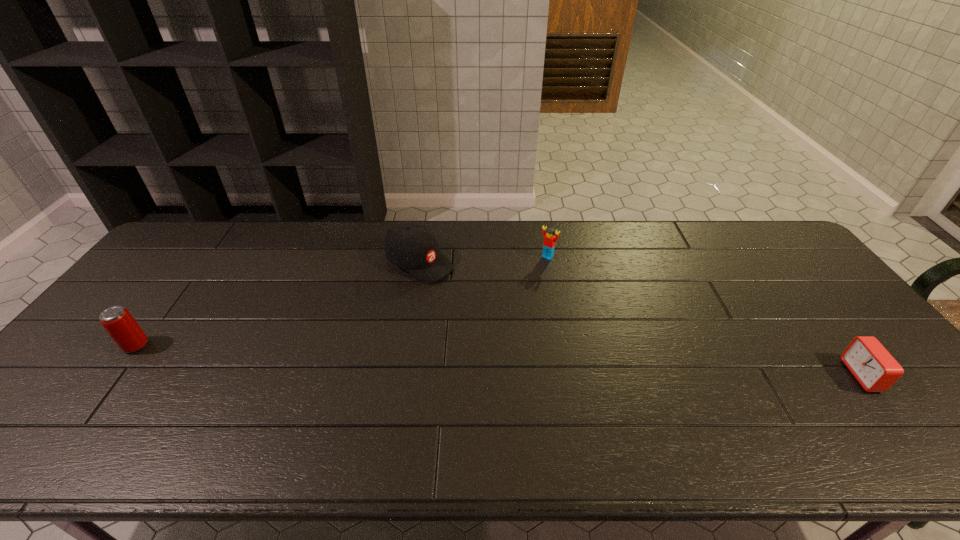
Identify the location of vacant space on the desktop that is between the leftmost object and the rightmost object and is positioned on the face of the second object from right to left. (457, 359).

In order to click on vacant space on the desktop that is between the beer can and the alarm clock and is positioned with a logo on the front of the second object from left to right in this screenshot , I will do `click(596, 364)`.